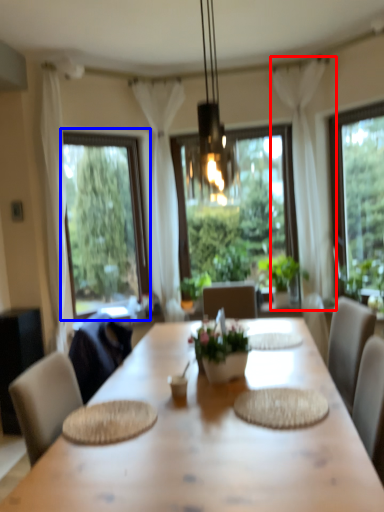
Question: Which point is closer to the camera, curtain (highlighted by a red box) or window (highlighted by a blue box)?

Choices:
 (A) curtain
 (B) window

Answer: (A)